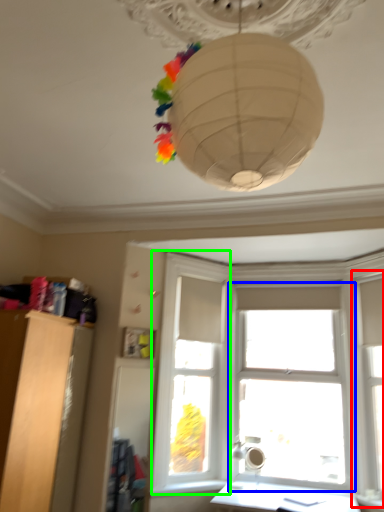
Question: Estimate the real-world distances between objects in this image. Which object is closer to window frame (highlighted by a red box), window (highlighted by a blue box) or window frame (highlighted by a green box)?

Choices:
 (A) window
 (B) window frame

Answer: (A)